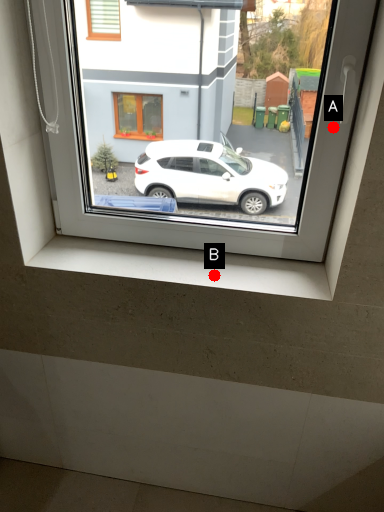
Question: Two points are circled on the image, labeled by A and B beside each circle. Which of the following is the closest to the observer?

Choices:
 (A) A is closer
 (B) B is closer

Answer: (A)